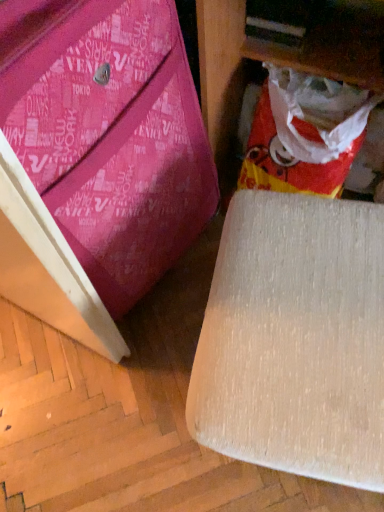
In order to click on red/yellow plastic bag at lower right in this screenshot , I will do `click(309, 135)`.

Identify the location of red/yellow plastic bag at lower right. (309, 135).

There is a red/yellow plastic bag at lower right. Where is `the 2nd furniture above it (from a real-world perspective)`? The width and height of the screenshot is (384, 512). the 2nd furniture above it (from a real-world perspective) is located at coordinates point(100,166).

Could you measure the distance between red/yellow plastic bag at lower right and pink fabric bag at lower left, acting as the 2th furniture starting from the right?

red/yellow plastic bag at lower right is 13.57 inches from pink fabric bag at lower left, acting as the 2th furniture starting from the right.

Does red/yellow plastic bag at lower right have a lesser width compared to pink fabric bag at lower left, which ranks as the 1th furniture in left-to-right order?

Yes.

Does red/yellow plastic bag at lower right appear on the left side of pink fabric bag at lower left, acting as the 2th furniture starting from the right?

Incorrect, red/yellow plastic bag at lower right is not on the left side of pink fabric bag at lower left, acting as the 2th furniture starting from the right.

From a real-world perspective, between beige fabric chair at lower right, which is the 2th furniture in left-to-right order, and pink fabric bag at lower left, which ranks as the 1th furniture in left-to-right order, who is vertically lower?

beige fabric chair at lower right, which is the 2th furniture in left-to-right order, is physically lower.

Are beige fabric chair at lower right, which is the 2th furniture in left-to-right order, and pink fabric bag at lower left, which ranks as the 1th furniture in left-to-right order, far apart?

No, there isn't a large distance between beige fabric chair at lower right, which is the 2th furniture in left-to-right order, and pink fabric bag at lower left, which ranks as the 1th furniture in left-to-right order.

Does beige fabric chair at lower right, the first furniture from the right, have a smaller size compared to pink fabric bag at lower left, acting as the 2th furniture starting from the right?

Correct, beige fabric chair at lower right, the first furniture from the right, occupies less space than pink fabric bag at lower left, acting as the 2th furniture starting from the right.

Which object is wider, beige fabric chair at lower right, the first furniture from the right, or pink fabric bag at lower left, acting as the 2th furniture starting from the right?

With larger width is beige fabric chair at lower right, the first furniture from the right.

What's the angular difference between pink fabric bag at lower left, which ranks as the 1th furniture in left-to-right order, and red/yellow plastic bag at lower right's facing directions?

The angle between the facing direction of pink fabric bag at lower left, which ranks as the 1th furniture in left-to-right order, and the facing direction of red/yellow plastic bag at lower right is 78.9 degrees.

Which object is closer to the camera taking this photo, pink fabric bag at lower left, acting as the 2th furniture starting from the right, or red/yellow plastic bag at lower right?

pink fabric bag at lower left, acting as the 2th furniture starting from the right.

Which is correct: pink fabric bag at lower left, acting as the 2th furniture starting from the right, is inside red/yellow plastic bag at lower right, or outside of it?

pink fabric bag at lower left, acting as the 2th furniture starting from the right, is not inside red/yellow plastic bag at lower right, it's outside.

In the scene shown: Is pink fabric bag at lower left, acting as the 2th furniture starting from the right, aimed at red/yellow plastic bag at lower right?

No, pink fabric bag at lower left, acting as the 2th furniture starting from the right, is not facing towards red/yellow plastic bag at lower right.

Considering their positions, is beige fabric chair at lower right, the first furniture from the right, located in front of or behind red/yellow plastic bag at lower right?

In the image, beige fabric chair at lower right, the first furniture from the right, appears in front of red/yellow plastic bag at lower right.

Is beige fabric chair at lower right, which is the 2th furniture in left-to-right order, to the left or to the right of red/yellow plastic bag at lower right in the image?

Clearly, beige fabric chair at lower right, which is the 2th furniture in left-to-right order, is on the left of red/yellow plastic bag at lower right in the image.

From a real-world perspective, is beige fabric chair at lower right, which is the 2th furniture in left-to-right order, physically located above or below red/yellow plastic bag at lower right?

beige fabric chair at lower right, which is the 2th furniture in left-to-right order, is situated higher than red/yellow plastic bag at lower right in the real world.

From the picture: Who is bigger, beige fabric chair at lower right, which is the 2th furniture in left-to-right order, or red/yellow plastic bag at lower right?

With larger size is beige fabric chair at lower right, which is the 2th furniture in left-to-right order.

From the picture: Is red/yellow plastic bag at lower right facing away from beige fabric chair at lower right, which is the 2th furniture in left-to-right order?

That's not correct — red/yellow plastic bag at lower right is not looking away from beige fabric chair at lower right, which is the 2th furniture in left-to-right order.

Is beige fabric chair at lower right, which is the 2th furniture in left-to-right order, inside red/yellow plastic bag at lower right?

No, beige fabric chair at lower right, which is the 2th furniture in left-to-right order, is not a part of red/yellow plastic bag at lower right.

From a real-world perspective, which object rests below the other?

red/yellow plastic bag at lower right.

Identify the location of shopping bag that appears behind the beige fabric chair at lower right, which is the 2th furniture in left-to-right order. (309, 135).

Considering the relative sizes of pink fabric bag at lower left, acting as the 2th furniture starting from the right, and beige fabric chair at lower right, which is the 2th furniture in left-to-right order, in the image provided, is pink fabric bag at lower left, acting as the 2th furniture starting from the right, smaller than beige fabric chair at lower right, which is the 2th furniture in left-to-right order,?

Actually, pink fabric bag at lower left, acting as the 2th furniture starting from the right, might be larger than beige fabric chair at lower right, which is the 2th furniture in left-to-right order.

Could you tell me if pink fabric bag at lower left, acting as the 2th furniture starting from the right, is facing beige fabric chair at lower right, which is the 2th furniture in left-to-right order?

Yes, pink fabric bag at lower left, acting as the 2th furniture starting from the right, is aimed at beige fabric chair at lower right, which is the 2th furniture in left-to-right order.

This screenshot has width=384, height=512. I want to click on furniture in front of the beige fabric chair at lower right, which is the 2th furniture in left-to-right order, so click(x=100, y=166).

Image resolution: width=384 pixels, height=512 pixels. I want to click on furniture that is the 2nd object to the left of the red/yellow plastic bag at lower right, starting at the anchor, so pyautogui.click(x=100, y=166).

Locate an element on the screen. furniture above the beige fabric chair at lower right, the first furniture from the right (from a real-world perspective) is located at coordinates (100, 166).

When comparing their distances from beige fabric chair at lower right, which is the 2th furniture in left-to-right order, does pink fabric bag at lower left, acting as the 2th furniture starting from the right, or red/yellow plastic bag at lower right seem closer?

pink fabric bag at lower left, acting as the 2th furniture starting from the right, is closer to beige fabric chair at lower right, which is the 2th furniture in left-to-right order.

Looking at this image, estimate the real-world distances between objects in this image. Which object is closer to red/yellow plastic bag at lower right, pink fabric bag at lower left, which ranks as the 1th furniture in left-to-right order, or beige fabric chair at lower right, which is the 2th furniture in left-to-right order?

pink fabric bag at lower left, which ranks as the 1th furniture in left-to-right order, lies closer to red/yellow plastic bag at lower right than the other object.

From the image, which object appears to be farther from red/yellow plastic bag at lower right, beige fabric chair at lower right, which is the 2th furniture in left-to-right order, or pink fabric bag at lower left, acting as the 2th furniture starting from the right?

beige fabric chair at lower right, which is the 2th furniture in left-to-right order, is positioned further to the anchor red/yellow plastic bag at lower right.

From the picture: Looking at the image, which one is located closer to pink fabric bag at lower left, which ranks as the 1th furniture in left-to-right order, red/yellow plastic bag at lower right or beige fabric chair at lower right, the first furniture from the right?

beige fabric chair at lower right, the first furniture from the right, is closer to pink fabric bag at lower left, which ranks as the 1th furniture in left-to-right order.

Based on their spatial positions, is beige fabric chair at lower right, which is the 2th furniture in left-to-right order, or red/yellow plastic bag at lower right further from pink fabric bag at lower left, acting as the 2th furniture starting from the right?

red/yellow plastic bag at lower right is further to pink fabric bag at lower left, acting as the 2th furniture starting from the right.

From the image, which object appears to be nearer to beige fabric chair at lower right, which is the 2th furniture in left-to-right order, red/yellow plastic bag at lower right or pink fabric bag at lower left, acting as the 2th furniture starting from the right?

Among the two, pink fabric bag at lower left, acting as the 2th furniture starting from the right, is located nearer to beige fabric chair at lower right, which is the 2th furniture in left-to-right order.

This screenshot has width=384, height=512. I want to click on furniture located between pink fabric bag at lower left, which ranks as the 1th furniture in left-to-right order, and red/yellow plastic bag at lower right in the left-right direction, so tap(295, 339).